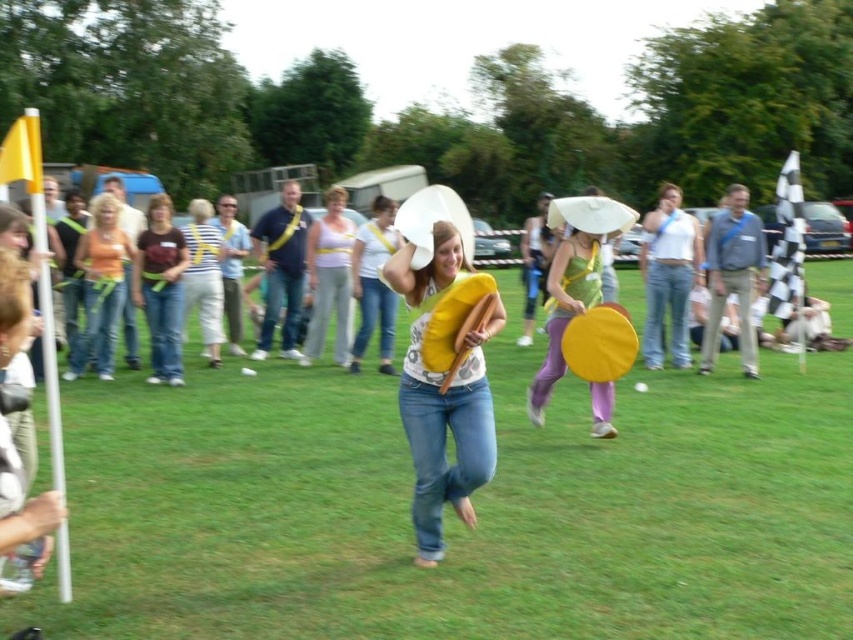
Who is taller, yellow matte shirt at center or matte white tank top at center?

With more height is matte white tank top at center.

What do you see at coordinates (442, 396) in the screenshot? I see `yellow matte shirt at center` at bounding box center [442, 396].

Does point (469, 400) come farther from viewer compared to point (316, 230)?

No, it is in front of (316, 230).

Locate an element on the screen. Image resolution: width=853 pixels, height=640 pixels. yellow matte shirt at center is located at coordinates (442, 396).

Between yellow matte shirt at center and denim jeans at center, which one is positioned lower?

yellow matte shirt at center

What do you see at coordinates (442, 396) in the screenshot? I see `yellow matte shirt at center` at bounding box center [442, 396].

Locate an element on the screen. yellow matte shirt at center is located at coordinates (442, 396).

Can you confirm if green grass at center is taller than orange denim jeans at left?

Incorrect, green grass at center's height is not larger of orange denim jeans at left's.

Based on the photo, does green grass at center appear on the right side of orange denim jeans at left?

Indeed, green grass at center is positioned on the right side of orange denim jeans at left.

Between point (450, 584) and point (99, 220), which one is positioned behind?

Positioned behind is point (99, 220).

Locate an element on the screen. The height and width of the screenshot is (640, 853). green grass at center is located at coordinates [x=451, y=512].